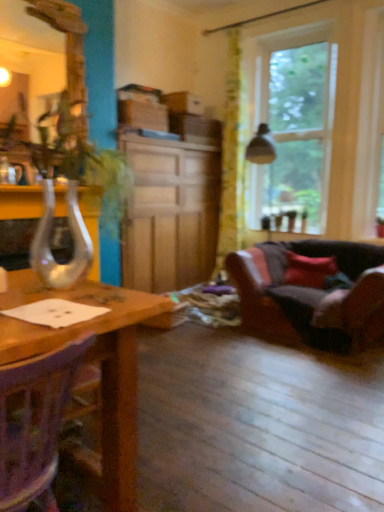
Question: Considering the relative positions of wooden chair at lower left and clear glass vase at left in the image provided, is wooden chair at lower left to the left of clear glass vase at left from the viewer's perspective?

Choices:
 (A) no
 (B) yes

Answer: (B)

Question: Can you confirm if wooden chair at lower left is wider than clear glass vase at left?

Choices:
 (A) yes
 (B) no

Answer: (B)

Question: Is wooden chair at lower left facing away from clear glass vase at left?

Choices:
 (A) no
 (B) yes

Answer: (A)

Question: From the image's perspective, does wooden chair at lower left appear lower than clear glass vase at left?

Choices:
 (A) yes
 (B) no

Answer: (A)

Question: Considering the relative positions of wooden chair at lower left and clear glass vase at left in the image provided, is wooden chair at lower left in front of clear glass vase at left?

Choices:
 (A) no
 (B) yes

Answer: (A)

Question: Is clear glass vase at left located within wooden chair at lower left?

Choices:
 (A) yes
 (B) no

Answer: (B)

Question: Considering the relative sizes of green floral fabric curtain at upper center and clear glass vase at left in the image provided, is green floral fabric curtain at upper center shorter than clear glass vase at left?

Choices:
 (A) no
 (B) yes

Answer: (A)

Question: Is green floral fabric curtain at upper center positioned behind clear glass vase at left?

Choices:
 (A) yes
 (B) no

Answer: (A)

Question: Is green floral fabric curtain at upper center beside clear glass vase at left?

Choices:
 (A) no
 (B) yes

Answer: (A)

Question: Does green floral fabric curtain at upper center have a larger size compared to clear glass vase at left?

Choices:
 (A) yes
 (B) no

Answer: (A)

Question: Is green floral fabric curtain at upper center wider than clear glass vase at left?

Choices:
 (A) no
 (B) yes

Answer: (A)

Question: Does green floral fabric curtain at upper center contain clear glass vase at left?

Choices:
 (A) no
 (B) yes

Answer: (A)

Question: Considering the relative positions of wooden cabinet at center and leather couch at lower right in the image provided, is wooden cabinet at center behind leather couch at lower right?

Choices:
 (A) yes
 (B) no

Answer: (A)